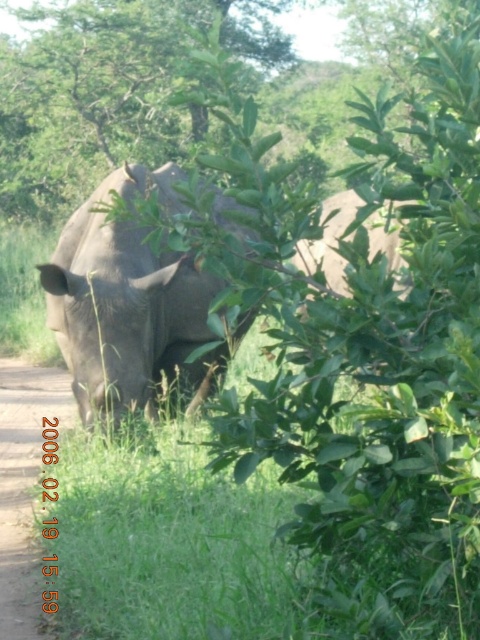
You are a hiker who wants to take a photo of the gray matte rhinoceros at center without stepping on the dirt path at lower left. Is there a clear path around the rhinoceros to move into position?

The gray matte rhinoceros at center is positioned over the dirt path at lower left, so stepping around it might require moving off the path. However, since the rhino is slightly off to the left, you could potentially move around it on the right side while staying on the path. But be cautious as the exact positioning isn

You are a wildlife photographer trying to capture a clear shot of the gray matte rhinoceros at center. However, there are dense green leaves in the foreground blocking your view. Can you adjust your camera position to focus on the gray matte rhinoceros at center without the leaves obstructing the point at coordinates point (127,308)?

The point (127,308) is on the gray matte rhinoceros at center, so adjusting the camera position to avoid the dense green leaves in the foreground would allow focusing on the rhinoceros without obstruction.

You are a hiker walking along the dirt path at lower left and see the gray matte rhinoceros at center. Can you safely walk under it without ducking?

The gray matte rhinoceros at center is much taller than the dirt path at lower left, so you would need to duck to avoid hitting your head on the rhinoceros.